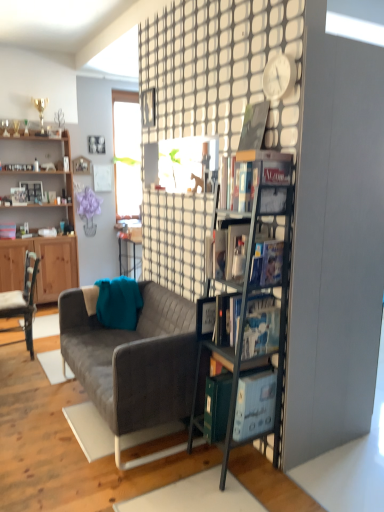
Question: In terms of size, does matte black picture frame at upper center, which appears as the third picture frame when ordered from the bottom, appear bigger or smaller than textured gray couch at center?

Choices:
 (A) big
 (B) small

Answer: (B)

Question: Looking at their shapes, would you say matte black picture frame at upper center, which appears as the third picture frame when ordered from the bottom, is wider or thinner than textured gray couch at center?

Choices:
 (A) wide
 (B) thin

Answer: (B)

Question: Which object is positioned closest to the matte black book at upper right, which is counted as the second book, starting from the top?

Choices:
 (A) white plastic clock at upper center
 (B) white matte picture frame at upper center, which ranks as the 3th picture frame in top-to-bottom order
 (C) textured gray couch at center
 (D) metallic gray bookshelf at center-right, placed as the second shelf when sorted from left to right
 (E) hardcover book at center, the 2th book when ordered from bottom to top

Answer: (D)

Question: Which is nearer to the teal fabric pillow at center?

Choices:
 (A) matte black picture frame at upper center, which appears as the third picture frame when ordered from the bottom
 (B) hardcover book at upper right, the 1th book when ordered from top to bottom
 (C) metallic gray bookshelf at center-right, arranged as the 1th shelf when viewed from the front
 (D) wooden picture frame at upper left, marked as the second picture frame in a bottom-to-top arrangement
 (E) wooden cabinet at left, the first shelf from the back

Answer: (C)